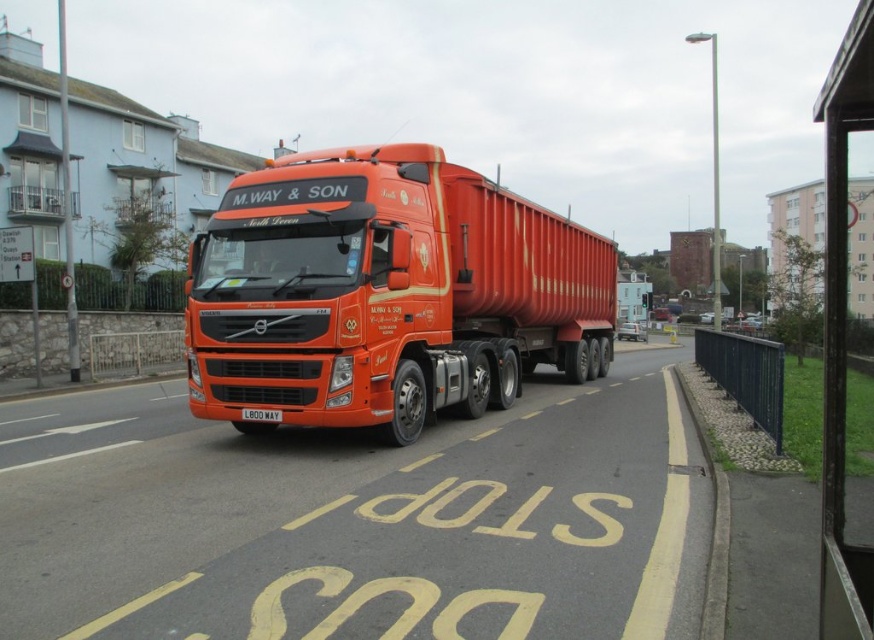
You are a pedestrian standing at the edge of the road. You see the shiny orange trailer truck at center and the white plastic license plate at center. Which object is closer to you?

The shiny orange trailer truck at center is closer to you because it is in front of the white plastic license plate at center.

You are a delivery driver who needs to pass under a low bridge that is 3 meters tall. You are driving the shiny orange trailer truck at center. The white plastic license plate at center is 15 cm tall. Can you safely pass under the bridge?

The shiny orange trailer truck at center is much taller than the white plastic license plate at center, which is only 15 cm tall. Since the bridge is 3 meters tall, the truck may still be able to pass safely as long as its total height does not exceed 3 meters. However, the exact clearance cannot be determined without knowing the truck height. Please check the truck height before proceeding.

You are a delivery driver who needs to park your shiny orange trailer truck at center in a parking spot that is exactly the same width as your white plastic license plate at center. Will the truck fit in the parking spot?

The shiny orange trailer truck at center is wider than the white plastic license plate at center, so the truck will not fit in the parking spot that matches the license plate width.